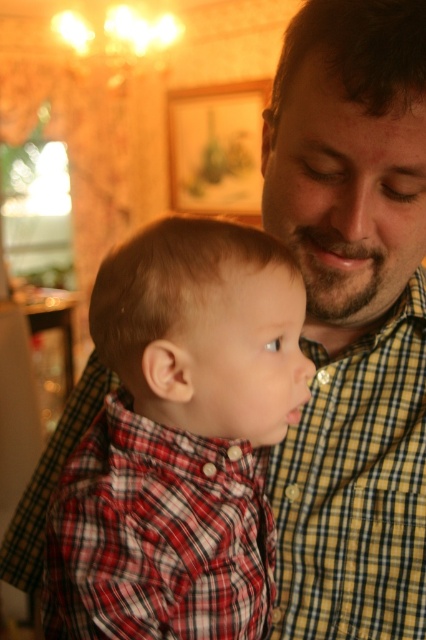
You are standing in the room and see the point at coordinates (180,440). Which object is this point located on?

The point at coordinates (180,440) is located on the red plaid shirt at center.

You are a photographer trying to capture a candid shot of the red plaid shirt at center. You have a camera that requires a minimum distance of 16 inches to focus properly. Can you take the photo from your current position?

The red plaid shirt at center and camera are 16.43 inches apart from each other. Since the required minimum distance is 16 inches, the camera can focus and take the photo.